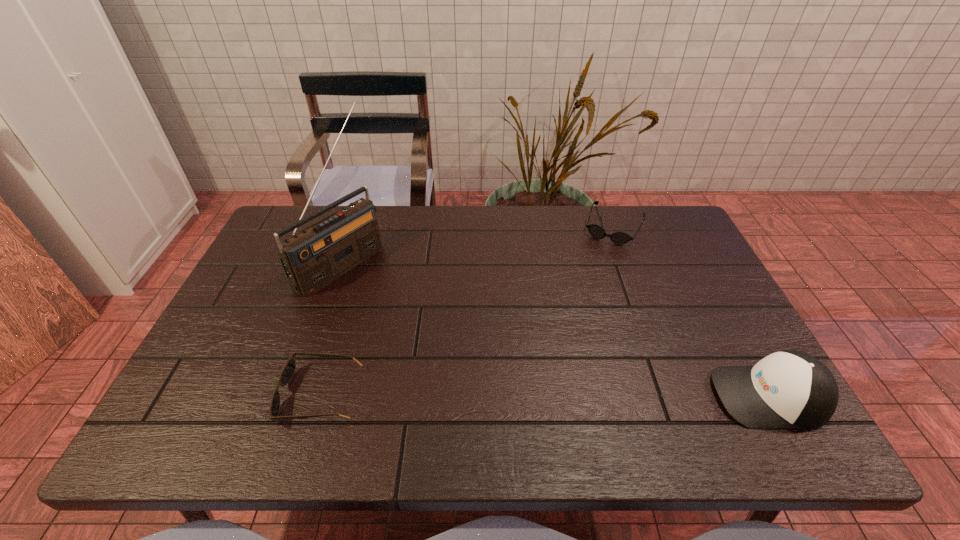
In order to click on the nearer sunglasses in this screenshot , I will do `click(288, 370)`.

Where is `the third shortest object`? This screenshot has height=540, width=960. the third shortest object is located at coordinates (789, 389).

Identify the location of radio receiver. The image size is (960, 540). (314, 257).

This screenshot has height=540, width=960. I want to click on the right sunglasses, so click(x=619, y=237).

Locate an element on the screen. free space located on the lenses of the left sunglasses is located at coordinates (224, 395).

This screenshot has width=960, height=540. In order to click on free spot located 0.150m on the lenses of the left sunglasses in this screenshot , I will do `click(215, 395)`.

Where is `vacant space located on the lenses of the left sunglasses`? This screenshot has width=960, height=540. vacant space located on the lenses of the left sunglasses is located at coordinates (179, 395).

Identify the location of vacant space located 0.110m on the front panel of the third shortest object. The height and width of the screenshot is (540, 960). (665, 396).

Locate an element on the screen. The image size is (960, 540). vacant space located 0.310m on the front panel of the third shortest object is located at coordinates (575, 396).

The image size is (960, 540). What are the coordinates of `vacant space located on the front panel of the third shortest object` in the screenshot? It's located at (637, 396).